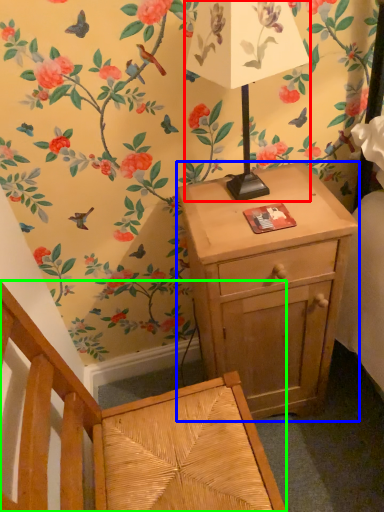
Question: Which is nearer to the table lamp (highlighted by a red box)? nightstand (highlighted by a blue box) or armchair (highlighted by a green box).

Choices:
 (A) nightstand
 (B) armchair

Answer: (A)